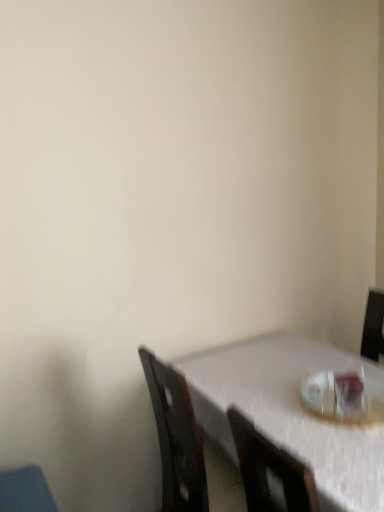
Question: From the image's perspective, is transparent plastic cup at lower right positioned above or below white textured table at lower right?

Choices:
 (A) above
 (B) below

Answer: (A)

Question: Considering the positions of transparent plastic cup at lower right and white textured table at lower right in the image, is transparent plastic cup at lower right wider or thinner than white textured table at lower right?

Choices:
 (A) wide
 (B) thin

Answer: (B)

Question: Visually, is transparent plastic cup at lower right positioned to the left or to the right of white textured table at lower right?

Choices:
 (A) left
 (B) right

Answer: (B)

Question: Looking at their shapes, would you say white textured table at lower right is wider or thinner than transparent plastic cup at lower right?

Choices:
 (A) thin
 (B) wide

Answer: (B)

Question: From the image's perspective, relative to transparent plastic cup at lower right, is white textured table at lower right above or below?

Choices:
 (A) above
 (B) below

Answer: (B)

Question: From a real-world perspective, is white textured table at lower right physically located above or below transparent plastic cup at lower right?

Choices:
 (A) above
 (B) below

Answer: (B)

Question: Visually, is white textured table at lower right positioned to the left or to the right of transparent plastic cup at lower right?

Choices:
 (A) left
 (B) right

Answer: (A)